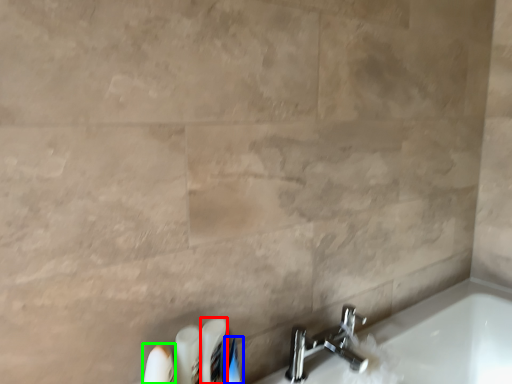
Question: Based on their relative distances, which object is farther from toiletry (highlighted by a red box)? Choose from toiletry (highlighted by a blue box) and toiletry (highlighted by a green box).

Choices:
 (A) toiletry
 (B) toiletry

Answer: (B)